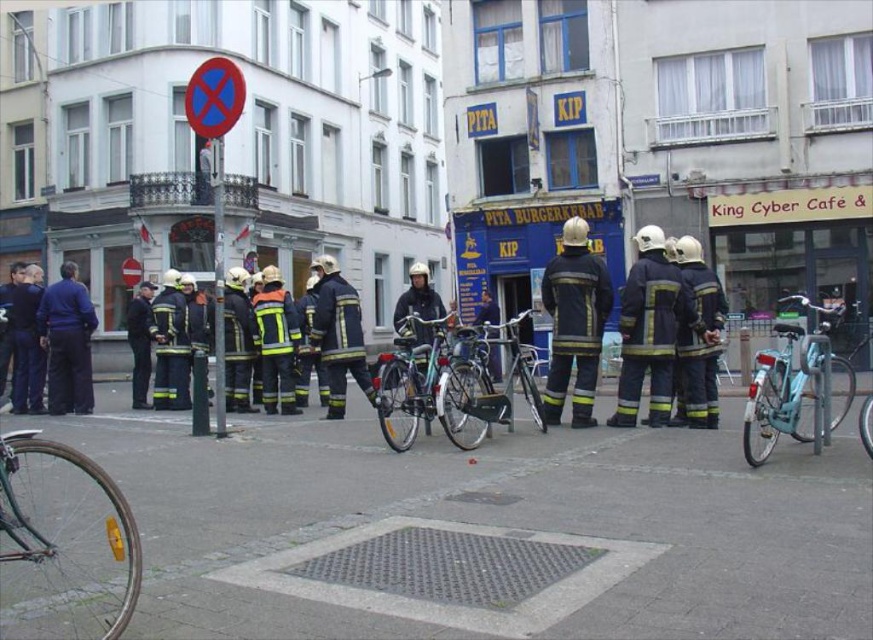
Question: Which point is farther to the camera?

Choices:
 (A) red circular sign at upper left
 (B) blue circular sign at upper center
 (C) yellow reflective plastic at lower left
 (D) shiny silver bicycle at center

Answer: (D)

Question: Which object is positioned closest to the blue circular sign at upper center?

Choices:
 (A) shiny metallic bicycle at center
 (B) red circular sign at upper left

Answer: (B)

Question: Is yellow reflective plastic at lower left wider than red circular sign at upper left?

Choices:
 (A) yes
 (B) no

Answer: (B)

Question: Where is yellow reflective plastic at lower left located in relation to shiny metallic bicycle at center in the image?

Choices:
 (A) right
 (B) left

Answer: (B)

Question: Among these objects, which one is farthest from the camera?

Choices:
 (A) blue circular sign at upper center
 (B) yellow reflective plastic at lower left

Answer: (A)

Question: Is shiny silver bicycle at center smaller than blue circular sign at upper center?

Choices:
 (A) no
 (B) yes

Answer: (B)